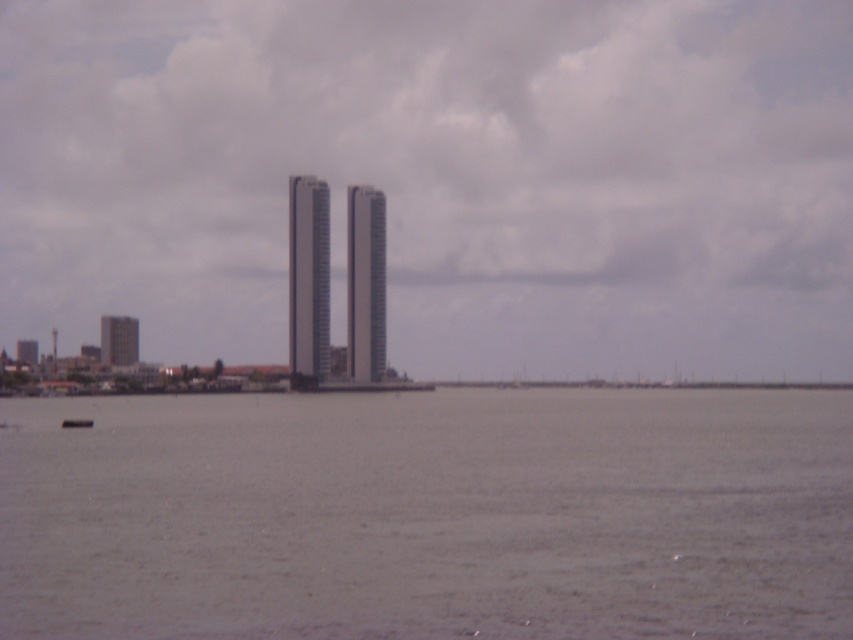
What do you see at coordinates (119, 339) in the screenshot?
I see `gray concrete tower at left` at bounding box center [119, 339].

Locate an element on the screen. This screenshot has height=640, width=853. gray concrete tower at left is located at coordinates (119, 339).

Is matte glass skyscrapers at center bigger than smooth gray skyscraper at center?

Indeed, matte glass skyscrapers at center has a larger size compared to smooth gray skyscraper at center.

Describe the element at coordinates (440, 177) in the screenshot. I see `matte glass skyscrapers at center` at that location.

Identify the location of matte glass skyscrapers at center. This screenshot has height=640, width=853. (440, 177).

Which is more to the left, gray concrete tower at left or black plastic boat at lower left?

gray concrete tower at left is more to the left.

Which is above, gray concrete tower at left or black plastic boat at lower left?

gray concrete tower at left

Which is behind, point (115, 353) or point (70, 426)?

The point (115, 353) is behind.

Locate an element on the screen. gray concrete tower at left is located at coordinates (119, 339).